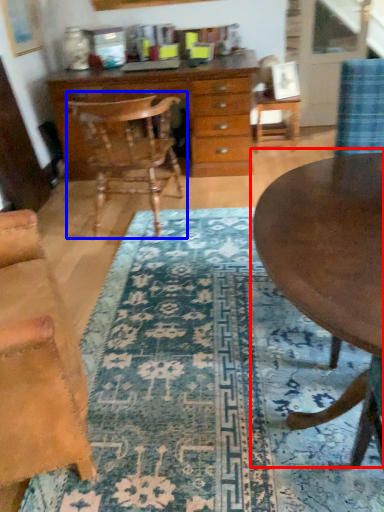
Question: Which object appears closest to the camera in this image, coffee table (highlighted by a red box) or chair (highlighted by a blue box)?

Choices:
 (A) coffee table
 (B) chair

Answer: (A)